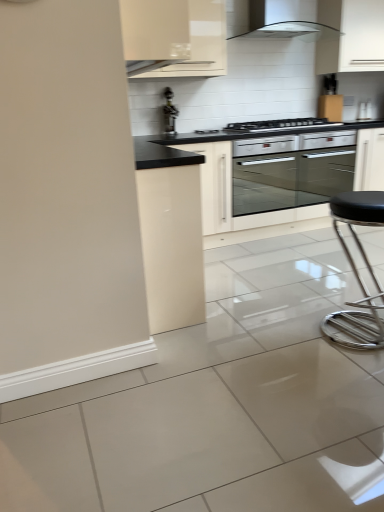
Question: Can you confirm if metallic silver bar stool at right is taller than metallic gold faucet at upper center?

Choices:
 (A) yes
 (B) no

Answer: (A)

Question: Is metallic silver bar stool at right oriented away from metallic gold faucet at upper center?

Choices:
 (A) no
 (B) yes

Answer: (B)

Question: Could you tell me if metallic silver bar stool at right is facing metallic gold faucet at upper center?

Choices:
 (A) yes
 (B) no

Answer: (B)

Question: From a real-world perspective, is metallic silver bar stool at right located higher than metallic gold faucet at upper center?

Choices:
 (A) no
 (B) yes

Answer: (A)

Question: Would you consider metallic silver bar stool at right to be distant from metallic gold faucet at upper center?

Choices:
 (A) yes
 (B) no

Answer: (A)

Question: Considering the relative sizes of metallic silver bar stool at right and metallic gold faucet at upper center in the image provided, is metallic silver bar stool at right bigger than metallic gold faucet at upper center?

Choices:
 (A) no
 (B) yes

Answer: (B)

Question: Is white glossy range hood at upper center to the right of white glossy cabinet at upper center, the first cabinetry from the front, from the viewer's perspective?

Choices:
 (A) no
 (B) yes

Answer: (B)

Question: From the image's perspective, is white glossy range hood at upper center on white glossy cabinet at upper center, acting as the second cabinetry starting from the back?

Choices:
 (A) yes
 (B) no

Answer: (A)

Question: Considering the relative positions of white glossy range hood at upper center and white glossy cabinet at upper center, acting as the second cabinetry starting from the back, in the image provided, is white glossy range hood at upper center behind white glossy cabinet at upper center, acting as the second cabinetry starting from the back,?

Choices:
 (A) no
 (B) yes

Answer: (B)

Question: Is white glossy range hood at upper center positioned far away from white glossy cabinet at upper center, the 1th cabinetry from the left?

Choices:
 (A) yes
 (B) no

Answer: (B)

Question: Is white glossy range hood at upper center outside white glossy cabinet at upper center, the 2th cabinetry from the right?

Choices:
 (A) no
 (B) yes

Answer: (B)

Question: Does white glossy range hood at upper center have a smaller size compared to white glossy cabinet at upper center, the 2th cabinetry from the right?

Choices:
 (A) no
 (B) yes

Answer: (B)

Question: Is metallic gold faucet at upper center smaller than metallic silver bar stool at right?

Choices:
 (A) yes
 (B) no

Answer: (A)